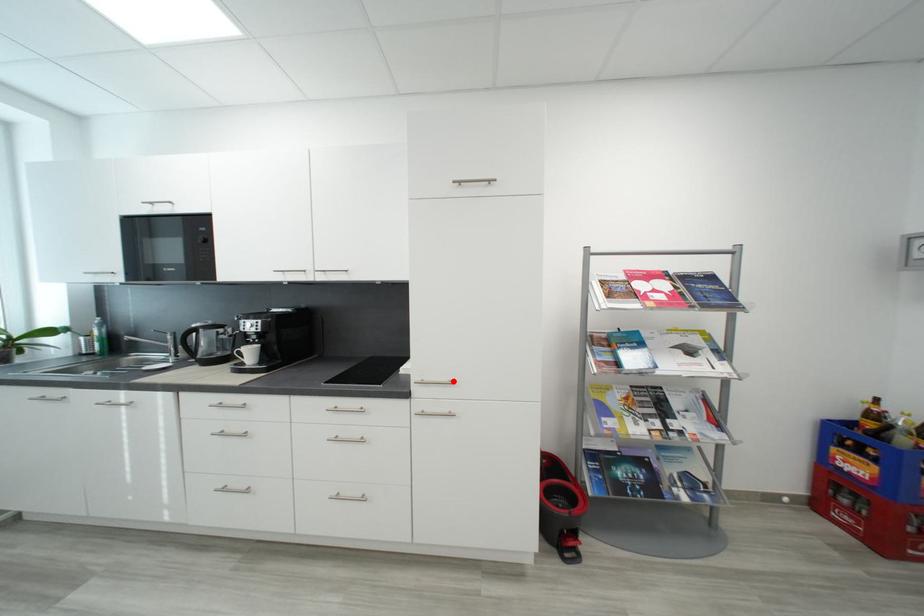
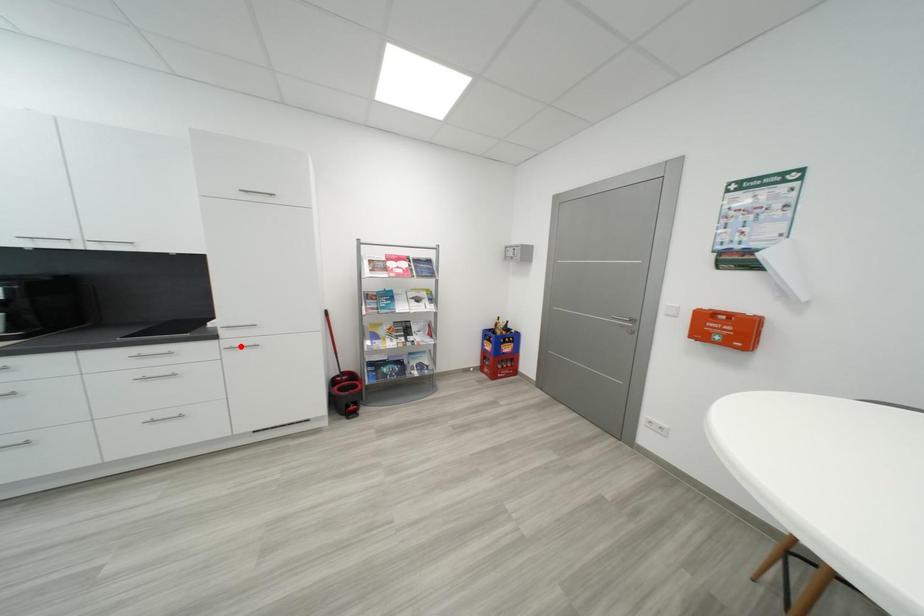
I am providing you with two images of the same scene from different viewpoints. A red point is marked on the first image and another point is marked on the second image. Is the marked point in image1 the same physical position as the marked point in image2?

No